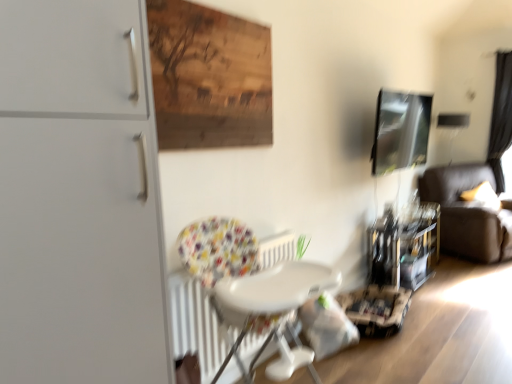
Question: Should I look upward or downward to see black fabric curtain at right?

Choices:
 (A) down
 (B) up

Answer: (B)

Question: Can white plastic chair at center be found inside metallic glossy picture frame at upper right?

Choices:
 (A) yes
 (B) no

Answer: (B)

Question: Is metallic glossy picture frame at upper right not close to white plastic chair at center?

Choices:
 (A) yes
 (B) no

Answer: (A)

Question: Does metallic glossy picture frame at upper right lie behind white plastic chair at center?

Choices:
 (A) yes
 (B) no

Answer: (A)

Question: Can you confirm if metallic glossy picture frame at upper right is taller than white plastic chair at center?

Choices:
 (A) no
 (B) yes

Answer: (A)

Question: Is metallic glossy picture frame at upper right closer to camera compared to white plastic chair at center?

Choices:
 (A) no
 (B) yes

Answer: (A)

Question: Does metallic glossy picture frame at upper right have a greater width compared to white plastic chair at center?

Choices:
 (A) yes
 (B) no

Answer: (B)

Question: Is the position of metallic glossy picture frame at upper right more distant than that of dark brown leather couch at right?

Choices:
 (A) yes
 (B) no

Answer: (B)

Question: Is metallic glossy picture frame at upper right not within dark brown leather couch at right?

Choices:
 (A) no
 (B) yes

Answer: (B)

Question: From the image's perspective, does metallic glossy picture frame at upper right appear higher than dark brown leather couch at right?

Choices:
 (A) no
 (B) yes

Answer: (B)

Question: Can you confirm if metallic glossy picture frame at upper right is wider than dark brown leather couch at right?

Choices:
 (A) yes
 (B) no

Answer: (B)

Question: From a real-world perspective, is metallic glossy picture frame at upper right positioned under dark brown leather couch at right based on gravity?

Choices:
 (A) yes
 (B) no

Answer: (B)

Question: Is the depth of metallic glossy picture frame at upper right less than that of dark brown leather couch at right?

Choices:
 (A) no
 (B) yes

Answer: (B)

Question: Are black fabric curtain at right and matte white cabinet at left located far from each other?

Choices:
 (A) no
 (B) yes

Answer: (B)